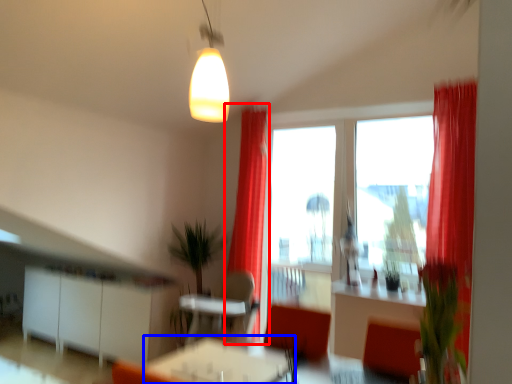
Question: Which point is further to the camera, curtain (highlighted by a red box) or table (highlighted by a blue box)?

Choices:
 (A) curtain
 (B) table

Answer: (A)